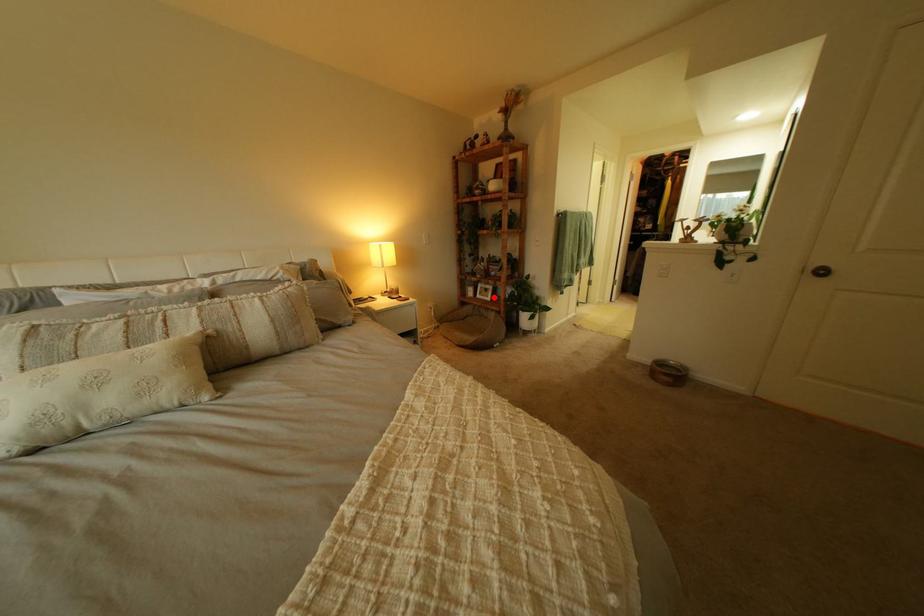
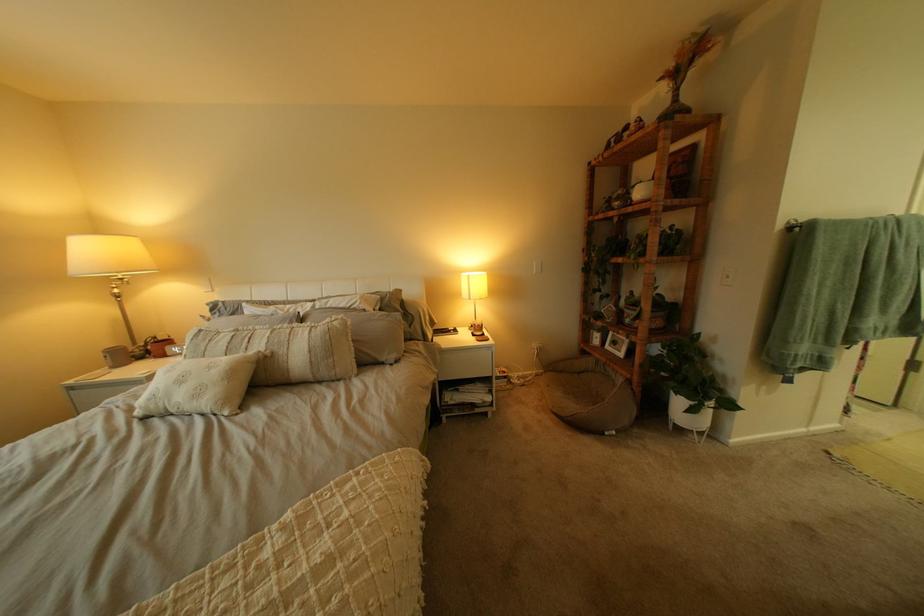
Where in the second image is the point corresponding to the highlighted location from the first image?

(623, 347)